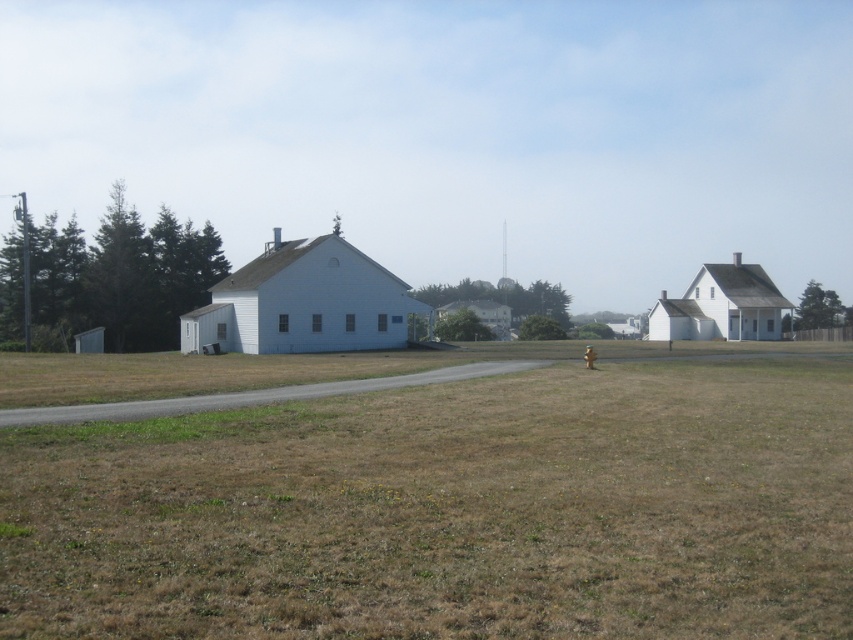
You are standing at the point marked by the coordinates point (x=437, y=497) in the image. Looking around, you see the brown grassy field at center and the two buildings. Which direction should you walk to reach the smaller building on the right?

The smaller building on the right is located to the east of the point marked by point (x=437, y=497). Therefore, you should walk east to reach it.

You are a gardener who needs to plant a new tree in the middle of the brown grassy field at center. There is a brown matte hydrant at center in the way. Can you move the hydrant to make space for the tree?

The brown grassy field at center has a larger size compared to brown matte hydrant at center, so there is enough space to plant the tree without moving the hydrant.